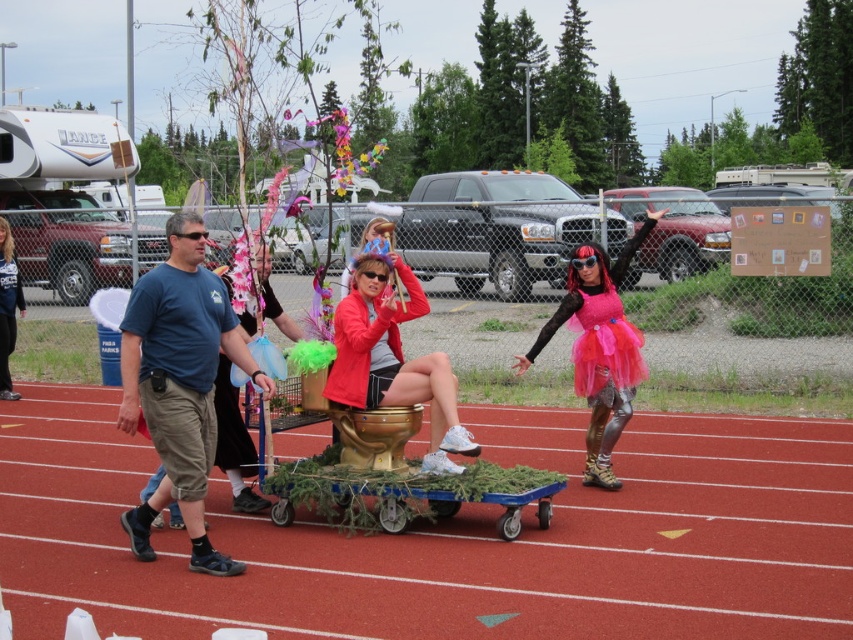
Question: Which point is closer to the camera taking this photo?

Choices:
 (A) (18, 273)
 (B) (157, 355)
 (C) (308, 570)

Answer: (B)

Question: Considering the real-world distances, which object is closest to the pink tulle skirt at center?

Choices:
 (A) blue cotton t-shirt at left
 (B) gold metallic toilet at center

Answer: (B)

Question: Based on their relative distances, which object is nearer to the gold metallic toilet at center?

Choices:
 (A) blue cotton t-shirt at left
 (B) brushed metal jacket at center
 (C) red rubber track at center

Answer: (A)

Question: Is blue cotton t-shirt at left to the right of gold metallic toilet at center from the viewer's perspective?

Choices:
 (A) yes
 (B) no

Answer: (B)

Question: Can you confirm if red rubber track at center is positioned below pink tulle skirt at center?

Choices:
 (A) no
 (B) yes

Answer: (B)

Question: Does blue cotton t-shirt at left appear on the left side of brushed metal jacket at center?

Choices:
 (A) yes
 (B) no

Answer: (B)